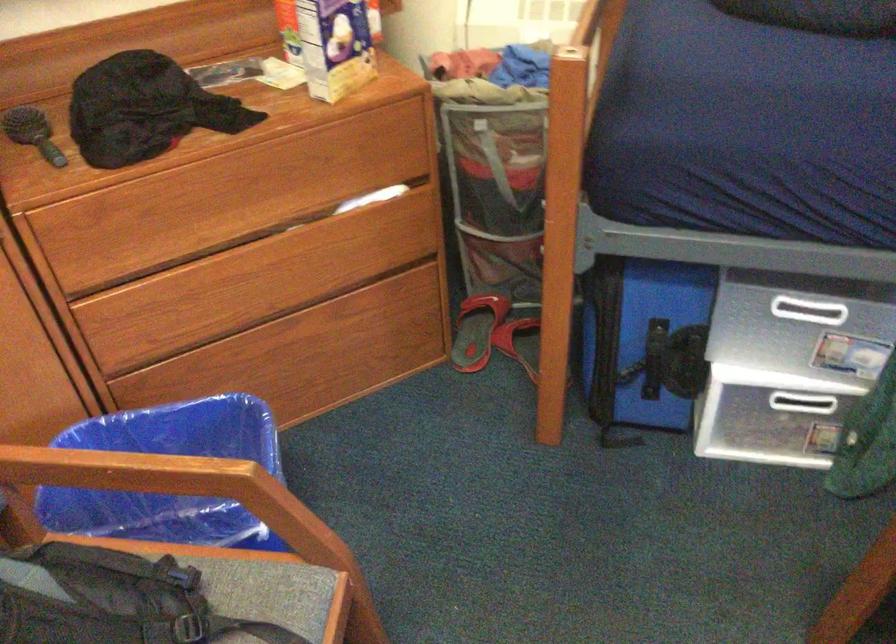
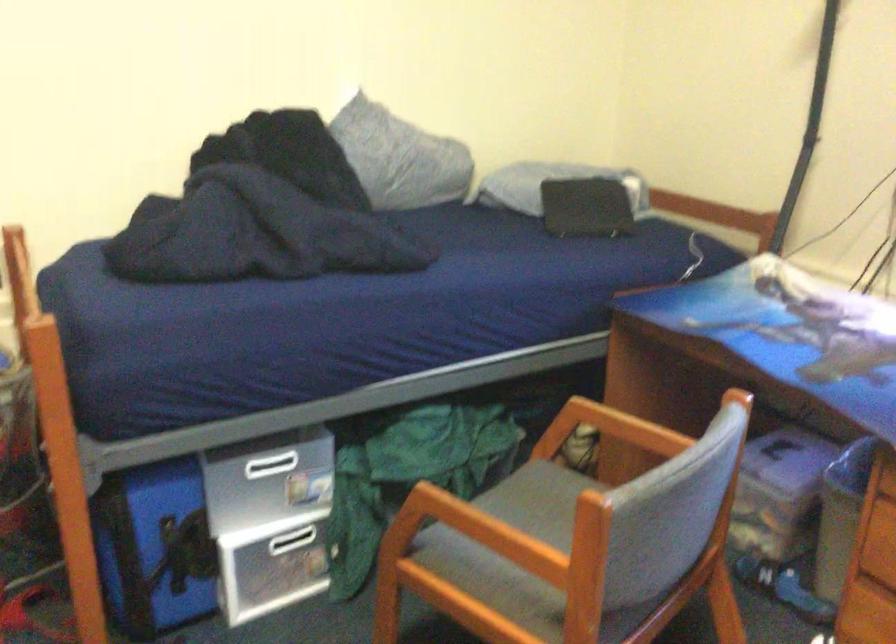
Question: How did the camera likely rotate?

Choices:
 (A) Left
 (B) Right
 (C) Up
 (D) Down

Answer: (B)